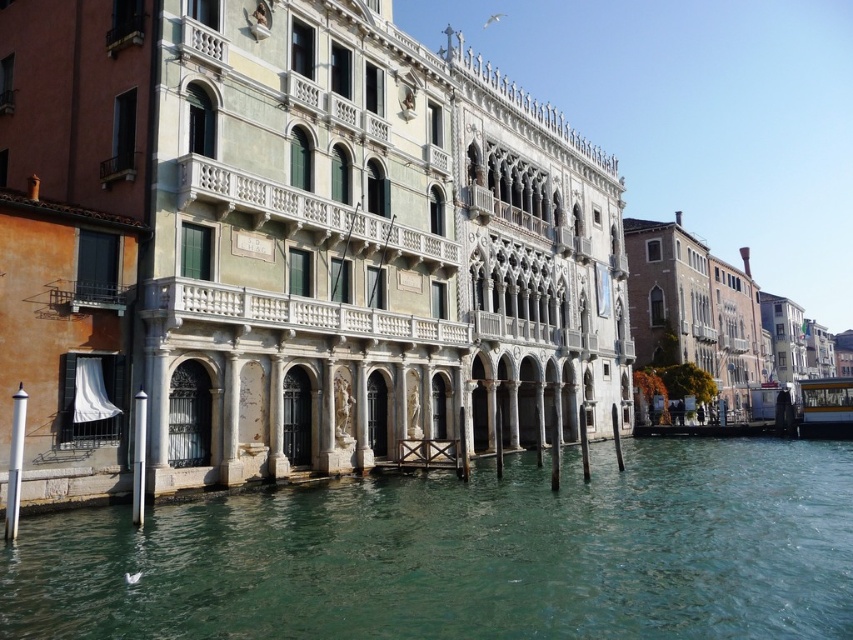
You are a tourist standing on the canal side and want to take a photo of the white marble palace at center and the greenish water at lower center. Which object should you focus on first if you want to capture both in one shot?

You should focus on the white marble palace at center first because it is located above the greenish water at lower center, so adjusting the camera to capture the palace will naturally include the water below in the frame.

You are standing on a bridge overlooking the canal. You see the white marble palace at center and the greenish water at lower center. Which object is positioned to the left when viewed from your perspective?

The white marble palace at center is positioned to the left of the greenish water at lower center from your perspective.